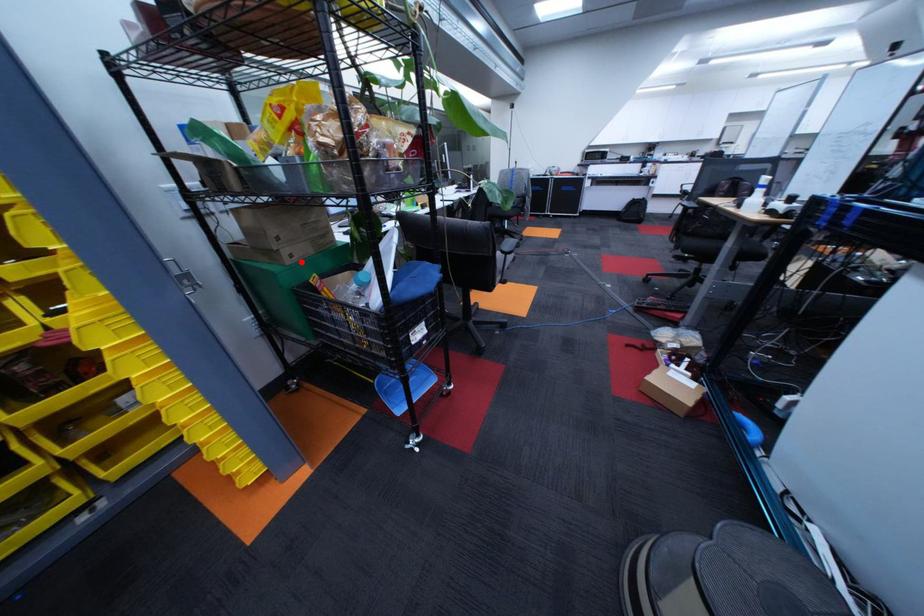
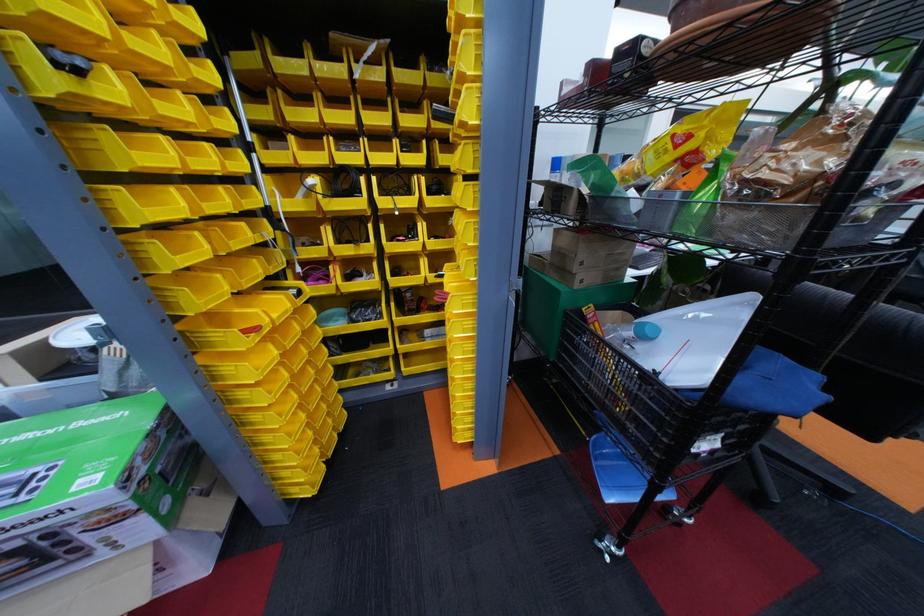
Find the pixel in the second image that matches the highlighted location in the first image.

(590, 286)